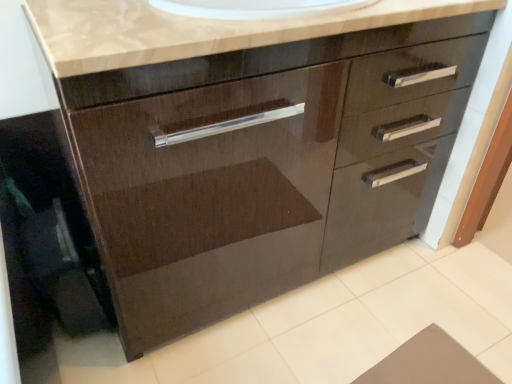
In order to click on marble countertop at upper center in this screenshot , I will do `click(196, 30)`.

Describe the element at coordinates (196, 30) in the screenshot. This screenshot has height=384, width=512. I see `marble countertop at upper center` at that location.

Where is `marble countertop at upper center`? marble countertop at upper center is located at coordinates (196, 30).